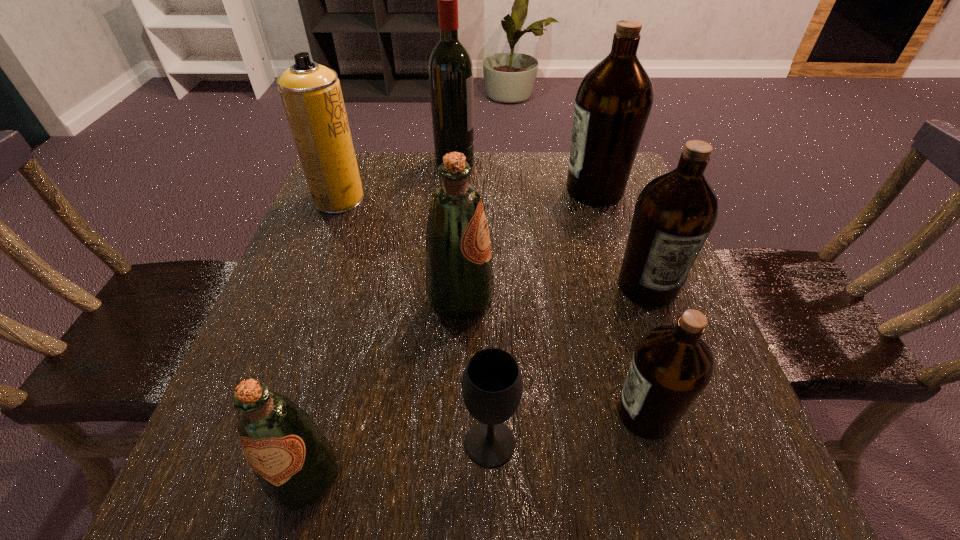
At what (x,y) coordinates should I click in order to perform the action: click on free space that is in between the smallest brown olive oil and the aerosol can. Please return your answer as a coordinate pair (x, y). Looking at the image, I should click on (492, 307).

At what (x,y) coordinates should I click in order to perform the action: click on vacant space that is in between the smallest brown olive oil and the aerosol can. Please return your answer as a coordinate pair (x, y). Image resolution: width=960 pixels, height=540 pixels. Looking at the image, I should click on (492, 307).

The height and width of the screenshot is (540, 960). I want to click on vacant area between the aerosol can and the nearest brown olive oil, so click(x=492, y=307).

Where is `object that stands as the sixth closest to the aerosol can`? object that stands as the sixth closest to the aerosol can is located at coordinates (492, 385).

Select which object is the seventh closest to the right green olive oil. Please provide its 2D coordinates. Your answer should be formatted as a tuple, i.e. [(x, y)], where the tuple contains the x and y coordinates of a point satisfying the conditions above.

[(450, 66)]

Point out which olive oil is positioned as the third nearest to the wineglass. Please provide its 2D coordinates. Your answer should be formatted as a tuple, i.e. [(x, y)], where the tuple contains the x and y coordinates of a point satisfying the conditions above.

[(459, 275)]

Image resolution: width=960 pixels, height=540 pixels. Find the location of `the second closest olive oil to the aerosol can`. the second closest olive oil to the aerosol can is located at coordinates (613, 102).

Point out which brown olive oil is positioned as the nearest to the aerosol can. Please provide its 2D coordinates. Your answer should be formatted as a tuple, i.e. [(x, y)], where the tuple contains the x and y coordinates of a point satisfying the conditions above.

[(613, 102)]

Identify which brown olive oil is the second closest to the farthest brown olive oil. Please provide its 2D coordinates. Your answer should be formatted as a tuple, i.e. [(x, y)], where the tuple contains the x and y coordinates of a point satisfying the conditions above.

[(671, 366)]

This screenshot has width=960, height=540. In order to click on free location that satisfies the following two spatial constraints: 1. on the front-facing side of the farther green olive oil; 2. on the left side of the wineglass in this screenshot , I will do tap(455, 443).